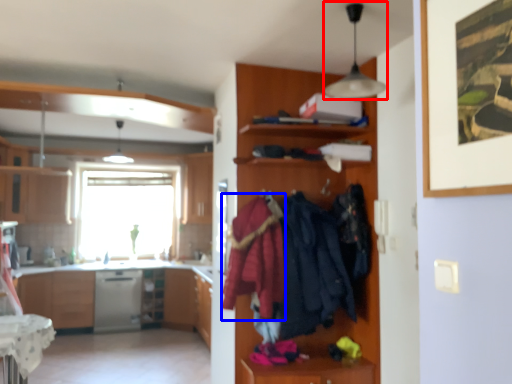
Question: Which of the following is the farthest to the observer, light fixture (highlighted by a red box) or clothing (highlighted by a blue box)?

Choices:
 (A) light fixture
 (B) clothing

Answer: (B)